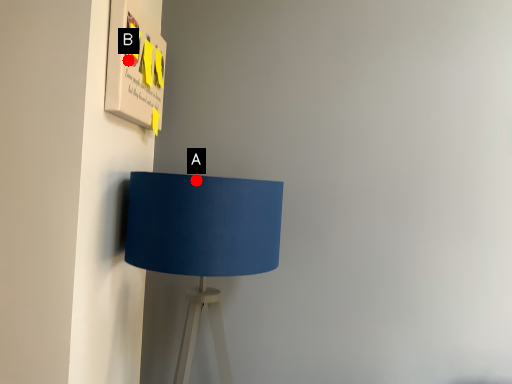
Question: Two points are circled on the image, labeled by A and B beside each circle. Which point is closer to the camera?

Choices:
 (A) A is closer
 (B) B is closer

Answer: (A)